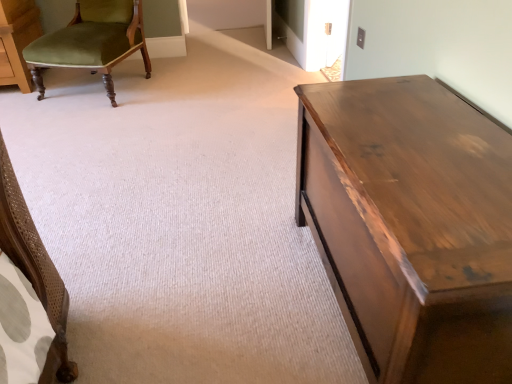
Question: Is shiny brown wood table at right bigger than green velvet chair at upper left?

Choices:
 (A) yes
 (B) no

Answer: (B)

Question: From a real-world perspective, does shiny brown wood table at right sit lower than green velvet chair at upper left?

Choices:
 (A) yes
 (B) no

Answer: (A)

Question: Is shiny brown wood table at right not near green velvet chair at upper left?

Choices:
 (A) yes
 (B) no

Answer: (A)

Question: Is shiny brown wood table at right positioned with its back to green velvet chair at upper left?

Choices:
 (A) yes
 (B) no

Answer: (B)

Question: Does shiny brown wood table at right appear on the left side of green velvet chair at upper left?

Choices:
 (A) yes
 (B) no

Answer: (B)

Question: Could you tell me if shiny brown wood table at right is facing green velvet chair at upper left?

Choices:
 (A) yes
 (B) no

Answer: (B)

Question: Are green velvet chair at upper left and shiny brown wood table at right making contact?

Choices:
 (A) yes
 (B) no

Answer: (B)

Question: From the image's perspective, does green velvet chair at upper left appear lower than shiny brown wood table at right?

Choices:
 (A) yes
 (B) no

Answer: (B)

Question: Considering the relative sizes of green velvet chair at upper left and shiny brown wood table at right in the image provided, is green velvet chair at upper left shorter than shiny brown wood table at right?

Choices:
 (A) yes
 (B) no

Answer: (B)

Question: Is green velvet chair at upper left turned away from shiny brown wood table at right?

Choices:
 (A) no
 (B) yes

Answer: (A)

Question: Is the depth of green velvet chair at upper left greater than that of shiny brown wood table at right?

Choices:
 (A) yes
 (B) no

Answer: (A)

Question: Does green velvet chair at upper left have a smaller size compared to shiny brown wood table at right?

Choices:
 (A) no
 (B) yes

Answer: (A)

Question: Is green velvet chair at upper left in front of or behind shiny brown wood table at right in the image?

Choices:
 (A) behind
 (B) front

Answer: (A)